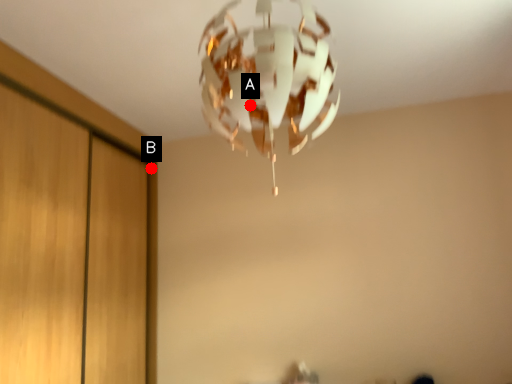
Question: Two points are circled on the image, labeled by A and B beside each circle. Which point is further to the camera?

Choices:
 (A) A is further
 (B) B is further

Answer: (B)